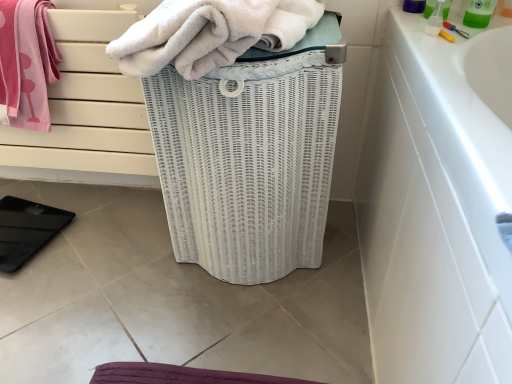
Question: Which direction should I rotate to look at white fluffy towel at center, which appears as the 1th towel when viewed from the right?

Choices:
 (A) left
 (B) right

Answer: (A)

Question: Should I look upward or downward to see green plastic bottle at upper right?

Choices:
 (A) down
 (B) up

Answer: (B)

Question: Considering the relative sizes of white fluffy towel at center, arranged as the second towel when viewed from the left, and pink cotton towel at upper left, which is the 1th towel in left-to-right order, in the image provided, is white fluffy towel at center, arranged as the second towel when viewed from the left, taller than pink cotton towel at upper left, which is the 1th towel in left-to-right order,?

Choices:
 (A) yes
 (B) no

Answer: (B)

Question: Is white fluffy towel at center, which appears as the 1th towel when viewed from the right, shorter than pink cotton towel at upper left, which is the 1th towel in left-to-right order?

Choices:
 (A) no
 (B) yes

Answer: (B)

Question: From a real-world perspective, is white fluffy towel at center, arranged as the second towel when viewed from the left, positioned under pink cotton towel at upper left, which is the 1th towel in left-to-right order, based on gravity?

Choices:
 (A) yes
 (B) no

Answer: (B)

Question: Is white fluffy towel at center, which appears as the 1th towel when viewed from the right, located outside pink cotton towel at upper left, which is the 2th towel in right-to-left order?

Choices:
 (A) no
 (B) yes

Answer: (B)

Question: Is white fluffy towel at center, arranged as the second towel when viewed from the left, thinner than pink cotton towel at upper left, which is the 2th towel in right-to-left order?

Choices:
 (A) yes
 (B) no

Answer: (B)

Question: Is white fluffy towel at center, which appears as the 1th towel when viewed from the right, positioned with its back to pink cotton towel at upper left, which is the 2th towel in right-to-left order?

Choices:
 (A) yes
 (B) no

Answer: (B)

Question: Is white wicker basket at center positioned beyond the bounds of white fluffy towel at center, which appears as the 1th towel when viewed from the right?

Choices:
 (A) no
 (B) yes

Answer: (B)

Question: Does white wicker basket at center lie in front of white fluffy towel at center, which appears as the 1th towel when viewed from the right?

Choices:
 (A) no
 (B) yes

Answer: (A)

Question: From a real-world perspective, is white wicker basket at center located higher than white fluffy towel at center, arranged as the second towel when viewed from the left?

Choices:
 (A) no
 (B) yes

Answer: (A)

Question: Considering the relative sizes of white wicker basket at center and white fluffy towel at center, which appears as the 1th towel when viewed from the right, in the image provided, is white wicker basket at center bigger than white fluffy towel at center, which appears as the 1th towel when viewed from the right,?

Choices:
 (A) no
 (B) yes

Answer: (B)

Question: Does white wicker basket at center have a greater width compared to white fluffy towel at center, arranged as the second towel when viewed from the left?

Choices:
 (A) no
 (B) yes

Answer: (A)

Question: Is white wicker basket at center to the left of white fluffy towel at center, which appears as the 1th towel when viewed from the right, from the viewer's perspective?

Choices:
 (A) no
 (B) yes

Answer: (A)

Question: Is green plastic bottle at upper right positioned in front of pink cotton towel at upper left, which is the 2th towel in right-to-left order?

Choices:
 (A) no
 (B) yes

Answer: (B)